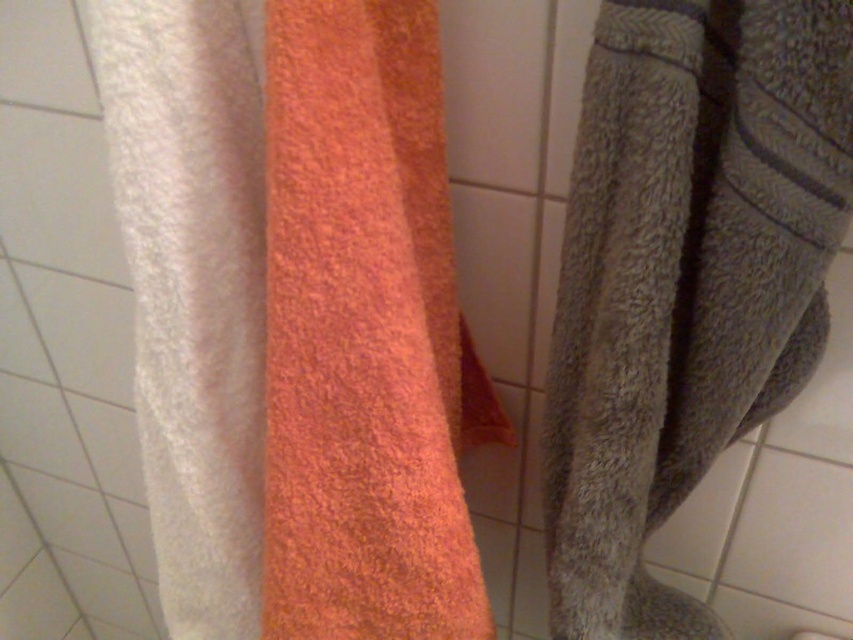
Measure the distance from white fluffy towel at left to gray textured towel at right.

white fluffy towel at left is 5.57 inches from gray textured towel at right.

Based on the photo, who is positioned more to the right, white fluffy towel at left or gray textured towel at right?

gray textured towel at right

The image size is (853, 640). I want to click on white fluffy towel at left, so click(294, 317).